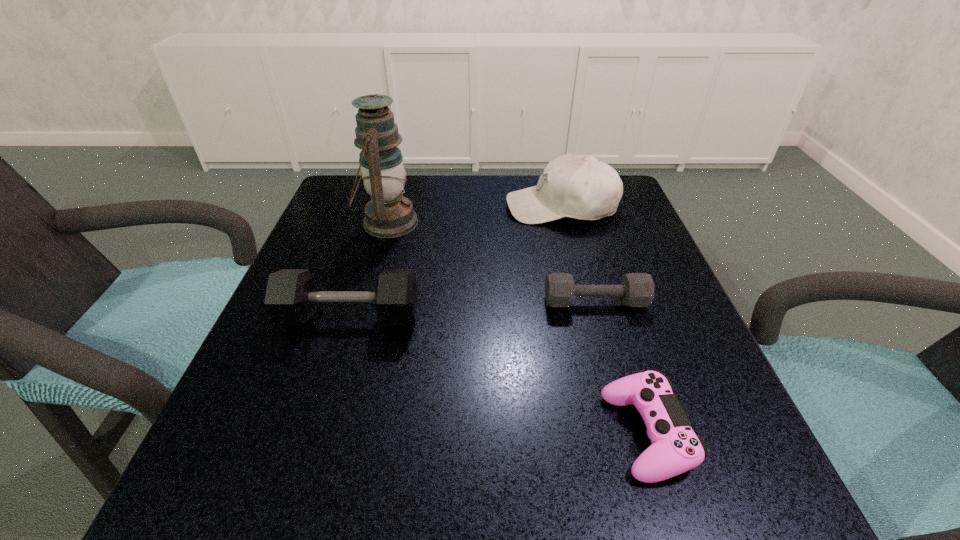
You are a GUI agent. You are given a task and a screenshot of the screen. Output one action in this format:
    pyautogui.click(x=<x>, y=<y>)
    Task: Click on the object that can be found as the second closest to the control
    This screenshot has height=540, width=960.
    Given the screenshot: What is the action you would take?
    pyautogui.click(x=290, y=298)

Find the location of a particular element. The width and height of the screenshot is (960, 540). free location that satisfies the following two spatial constraints: 1. on the front-facing side of the second tallest object; 2. on the left side of the right dumbbell is located at coordinates (586, 302).

Where is `blank space that satisfies the following two spatial constraints: 1. on the front side of the nearest object; 2. on the left side of the right dumbbell`? blank space that satisfies the following two spatial constraints: 1. on the front side of the nearest object; 2. on the left side of the right dumbbell is located at coordinates (632, 433).

Find the location of a particular element. vacant space that satisfies the following two spatial constraints: 1. on the front side of the right dumbbell; 2. on the left side of the oil lamp is located at coordinates (366, 302).